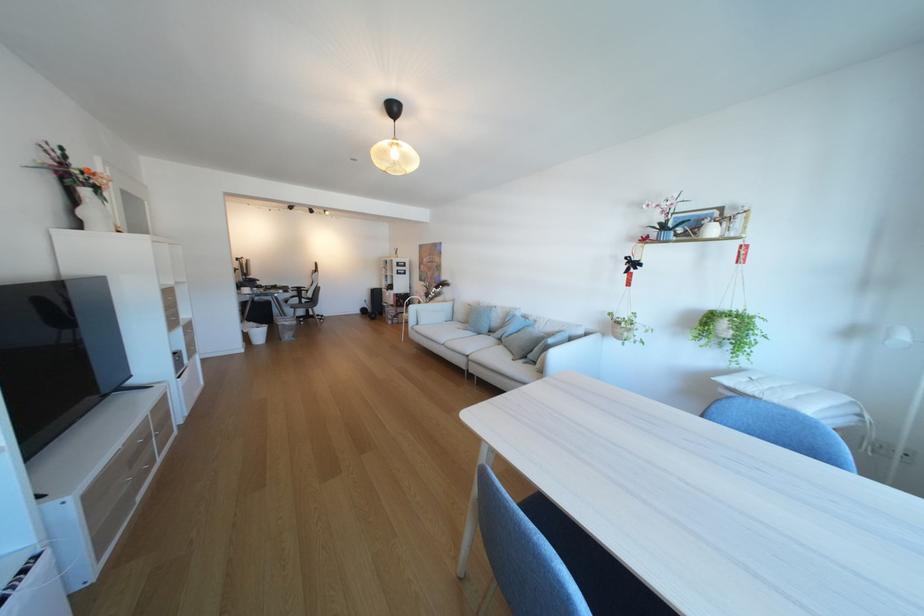
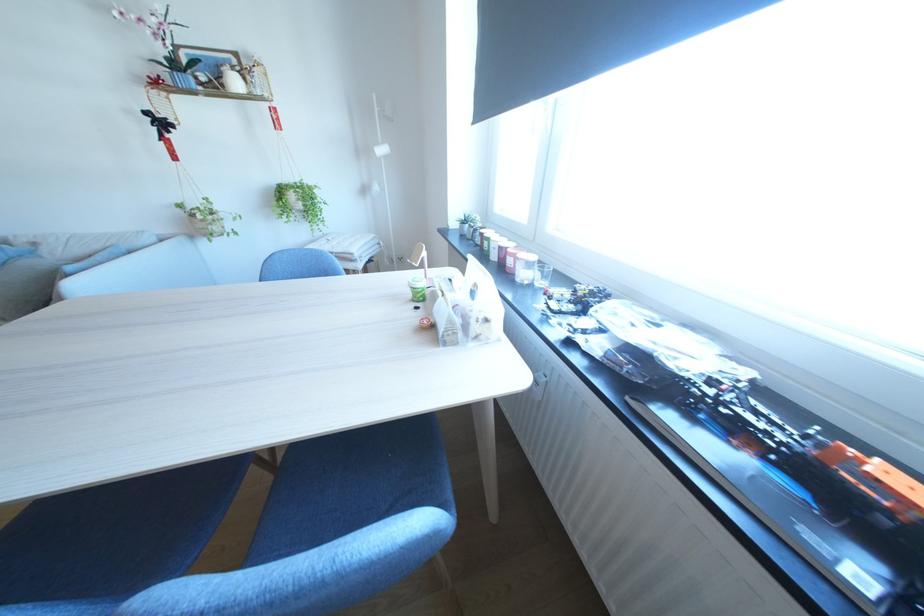
Find the pixel in the second image that matches pixel 723 322 in the first image.

(295, 196)